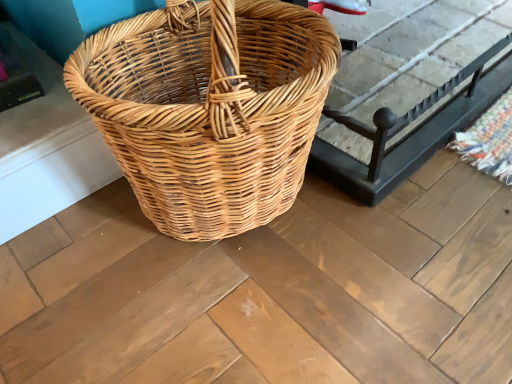
Question: Is there a large distance between natural wicker basket at center and natural wicker picnic basket at center?

Choices:
 (A) no
 (B) yes

Answer: (A)

Question: Is natural wicker basket at center oriented away from natural wicker picnic basket at center?

Choices:
 (A) no
 (B) yes

Answer: (A)

Question: Is natural wicker basket at center shorter than natural wicker picnic basket at center?

Choices:
 (A) no
 (B) yes

Answer: (B)

Question: Is natural wicker basket at center outside of natural wicker picnic basket at center?

Choices:
 (A) yes
 (B) no

Answer: (A)

Question: Could natural wicker picnic basket at center be considered to be inside natural wicker basket at center?

Choices:
 (A) yes
 (B) no

Answer: (B)

Question: Is the surface of natural wicker basket at center in direct contact with natural wicker picnic basket at center?

Choices:
 (A) no
 (B) yes

Answer: (A)

Question: From the image's perspective, is natural wicker picnic basket at center on top of natural wicker basket at center?

Choices:
 (A) yes
 (B) no

Answer: (B)

Question: Is natural wicker picnic basket at center located outside natural wicker basket at center?

Choices:
 (A) yes
 (B) no

Answer: (A)

Question: Does natural wicker picnic basket at center have a greater width compared to natural wicker basket at center?

Choices:
 (A) no
 (B) yes

Answer: (A)

Question: Considering the relative sizes of natural wicker picnic basket at center and natural wicker basket at center in the image provided, is natural wicker picnic basket at center smaller than natural wicker basket at center?

Choices:
 (A) no
 (B) yes

Answer: (B)

Question: Does natural wicker picnic basket at center have a greater height compared to natural wicker basket at center?

Choices:
 (A) yes
 (B) no

Answer: (A)

Question: Is natural wicker picnic basket at center shorter than natural wicker basket at center?

Choices:
 (A) yes
 (B) no

Answer: (B)

Question: Is natural wicker basket at center spatially inside natural wicker picnic basket at center, or outside of it?

Choices:
 (A) inside
 (B) outside

Answer: (B)